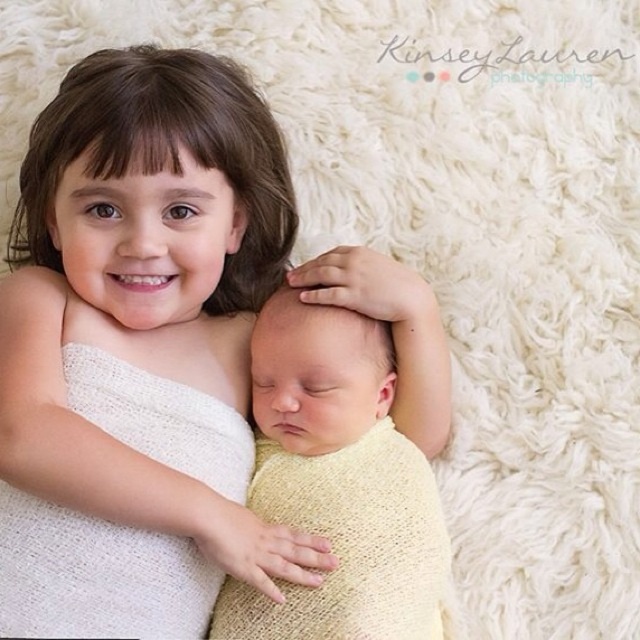
From the picture: You are a photographer setting up a shot. You have a camera with a 5 inch wide lens. You need to capture both the white knitted fabric at upper left and the yellow knitted fabric at center in the same frame. Can you position the camera so that both fabrics are entirely within the lens view without moving them?

The white knitted fabric at upper left is 4.79 inches from the yellow knitted fabric at center. Since the distance between them is less than the 5 inch wide lens, yes, the camera can be positioned to include both fabrics within the 5 inch lens view.

You are a photographer taking a picture of two children on a white rug. You notice the white knitted fabric at upper left and the yellow knitted fabric at center. Which fabric is larger in size?

The white knitted fabric at upper left is bigger than the yellow knitted fabric at center according to the description.

You are a photographer setting up a shot of the two children on the rug. You need to place a small prop between the two points marked as point [131,289] and point [372,548]. Which point should the prop be closer to if you want it to appear closer to the camera in the final photo?

The prop should be placed closer to point [131,289] because it is closer to the camera than point [372,548].